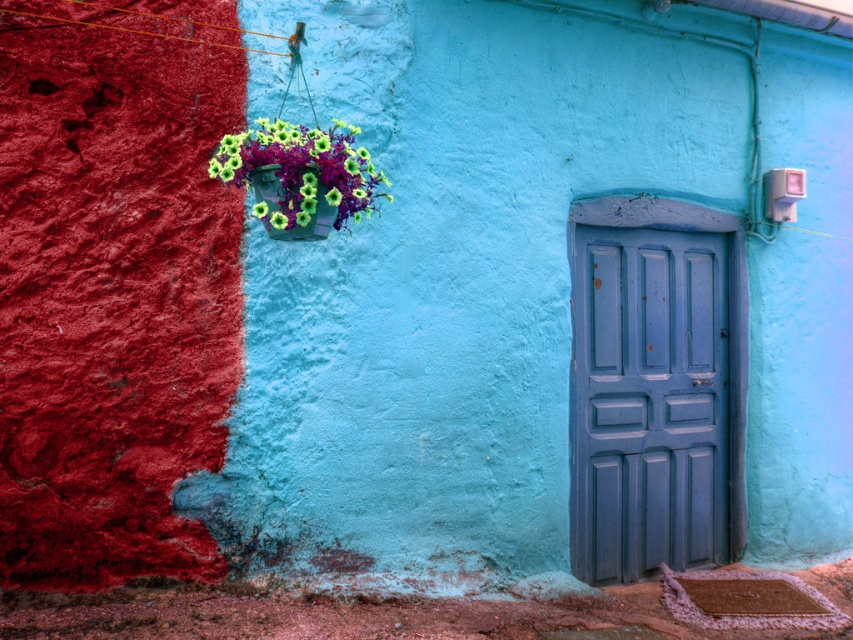
Question: Can you confirm if blue matte door at center is positioned below matte plastic flowers at upper left?

Choices:
 (A) no
 (B) yes

Answer: (B)

Question: Among these objects, which one is nearest to the camera?

Choices:
 (A) matte plastic flowers at upper left
 (B) blue matte door at center

Answer: (A)

Question: Which of the following is the closest to the observer?

Choices:
 (A) (650, 570)
 (B) (231, 164)

Answer: (B)

Question: Is blue matte door at center to the right of matte plastic flowers at upper left from the viewer's perspective?

Choices:
 (A) yes
 (B) no

Answer: (A)

Question: Can you confirm if blue matte door at center is positioned to the right of matte plastic flowers at upper left?

Choices:
 (A) yes
 (B) no

Answer: (A)